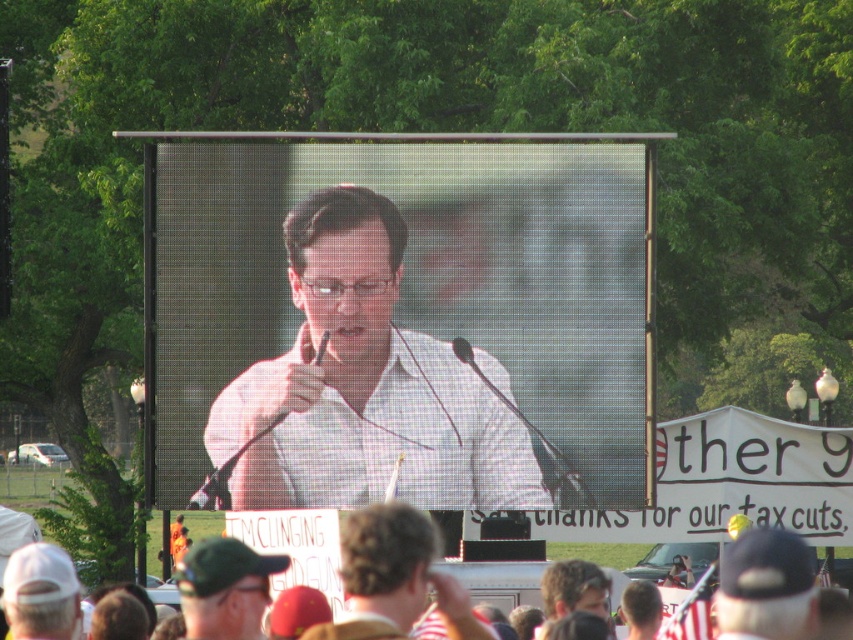
You are standing at the front of the event and want to see the large screen. Is the green cap at center blocking your view of the screen?

The green cap at center is located at point (x=225, y=588), which is in the foreground. Since you are at the front, the green cap at center would be between you and the screen, blocking your view.